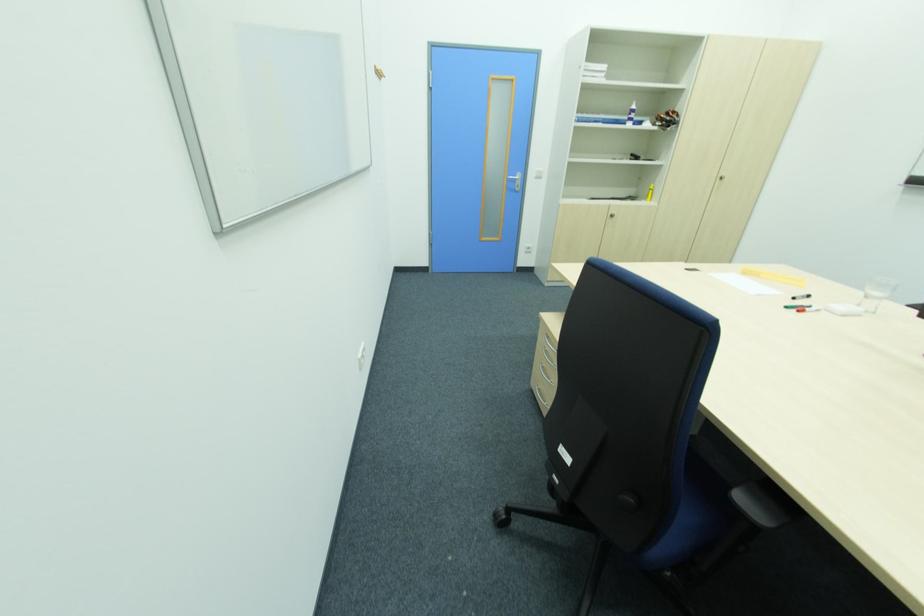
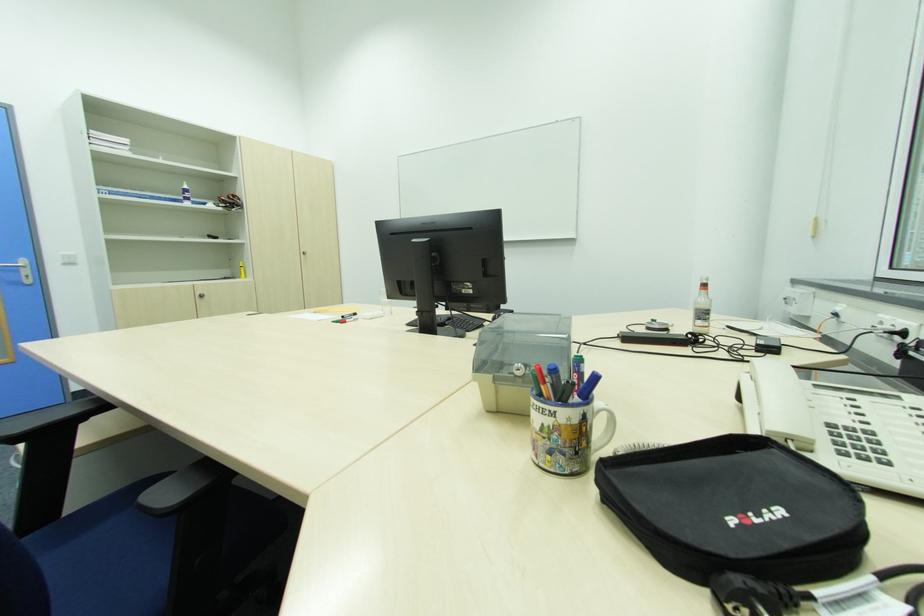
Question: The camera is either moving clockwise (left) or counter-clockwise (right) around the object. The first image is from the beginning of the video and the second image is from the end. Is the camera moving left or right when shooting the video?

Choices:
 (A) Left
 (B) Right

Answer: (A)